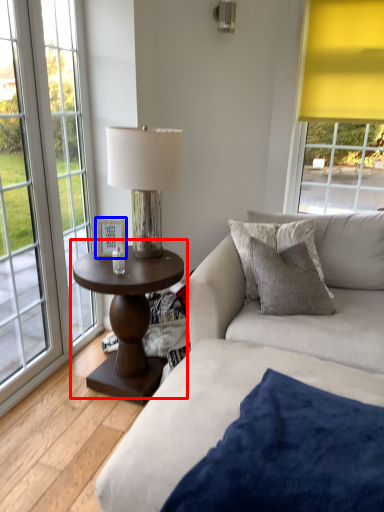
Question: Which object is further to the camera taking this photo, coffee table (highlighted by a red box) or picture frame (highlighted by a blue box)?

Choices:
 (A) coffee table
 (B) picture frame

Answer: (B)